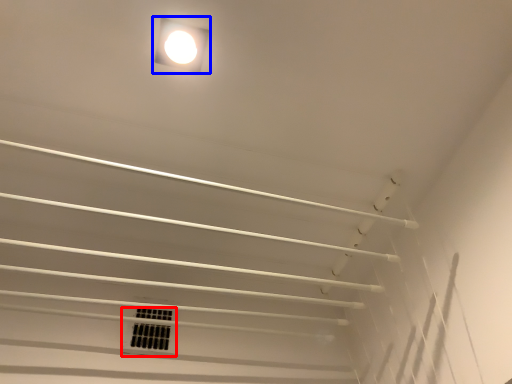
Question: Which object appears closest to the camera in this image, window (highlighted by a red box) or lamp (highlighted by a blue box)?

Choices:
 (A) window
 (B) lamp

Answer: (B)